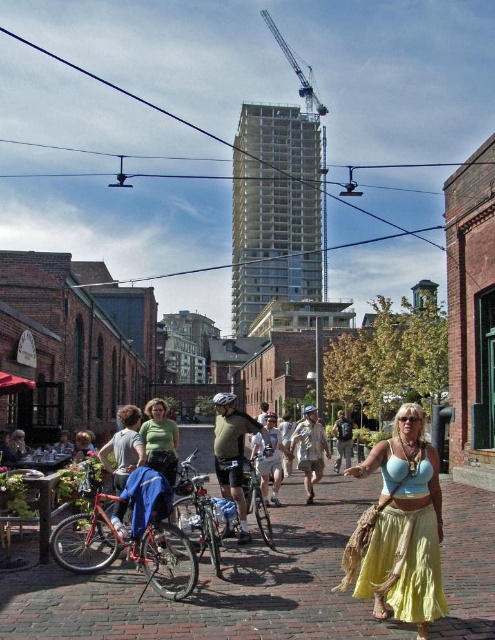
You are a delivery person trying to reach the light brown leather jacket at center. You are currently standing on the brick pavement at center. Which direction should you move to get closer to the jacket?

The brick pavement at center is to the left of light brown leather jacket at center, so you should move to the right to get closer to the jacket.

You are a fashion designer observing the urban scene. You notice the khaki cotton shorts at center and the light brown leather jacket at center. Which clothing item appears narrower in the image?

The khaki cotton shorts at center has a lesser width compared to the light brown leather jacket at center, so the khaki cotton shorts at center appears narrower.